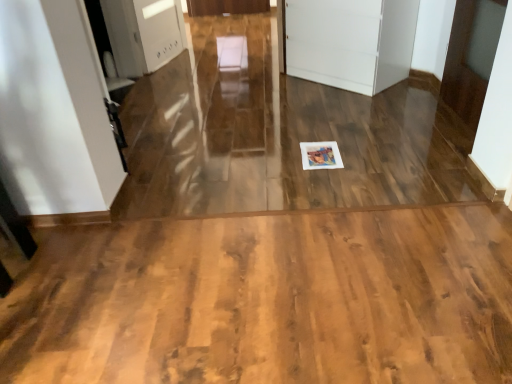
Locate an element on the screen. The height and width of the screenshot is (384, 512). free space between white matte cabinet at center, which is the 2th door from right to left, and white glossy door at upper right, which is counted as the 1th door, starting from the right is located at coordinates click(396, 102).